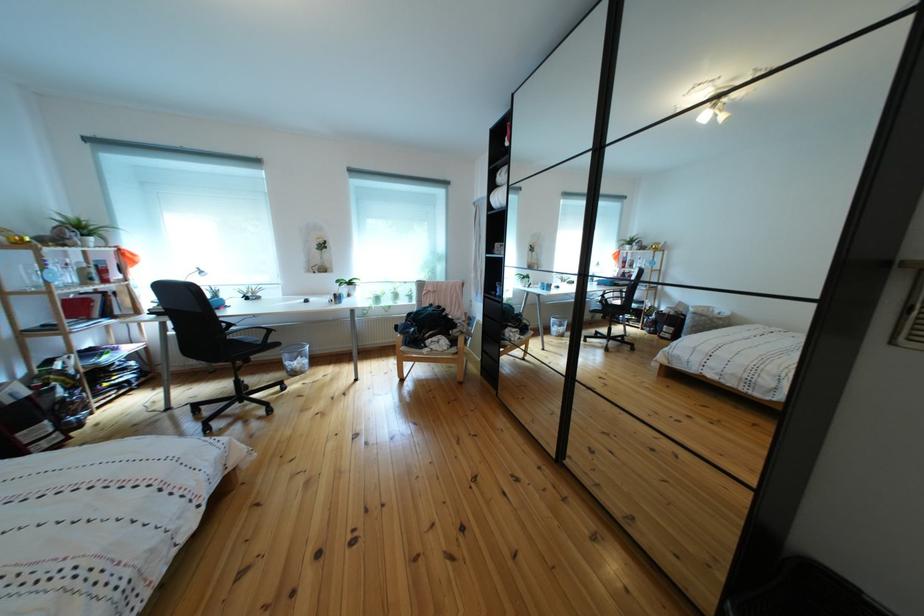
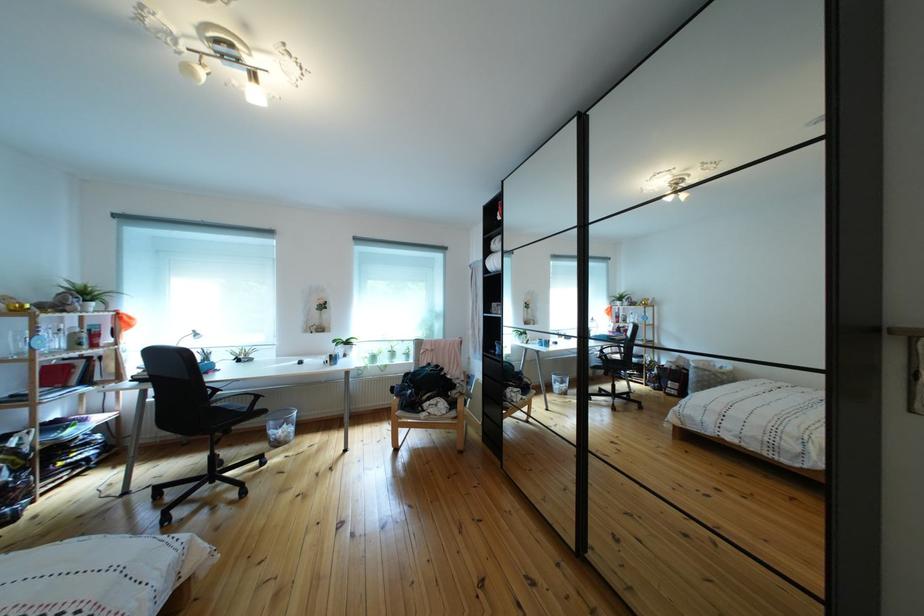
Find the pixel in the second image that matches (x=226, y=323) in the first image.

(214, 389)